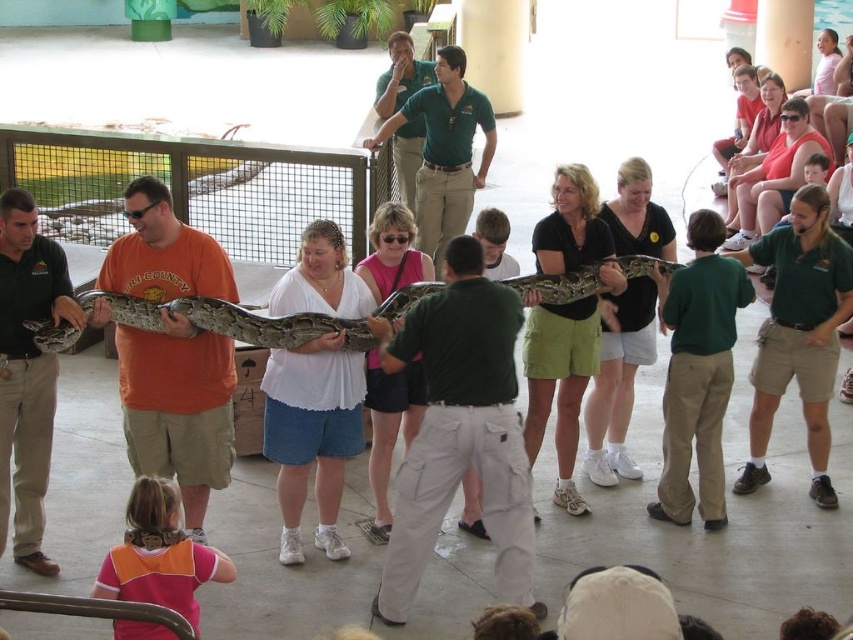
Question: Among these objects, which one is nearest to the camera?

Choices:
 (A) matte green shirt at center
 (B) white matte shirt at center
 (C) orange cotton shirt at center

Answer: (A)

Question: Can you confirm if matte green shirt at center is positioned to the right of shiny brown snake at center?

Choices:
 (A) no
 (B) yes

Answer: (A)

Question: Which of the following is the closest to the observer?

Choices:
 (A) orange cotton shirt at center
 (B) matte green shirt at center
 (C) camouflage snake at center
 (D) white matte shirt at center

Answer: (B)

Question: Considering the relative positions of matte green shirt at center and shiny brown snake at center in the image provided, where is matte green shirt at center located with respect to shiny brown snake at center?

Choices:
 (A) above
 (B) below

Answer: (B)

Question: Which point is farther to the camera?

Choices:
 (A) (276, 337)
 (B) (355, 300)

Answer: (B)

Question: Can you confirm if white matte shirt at center is positioned above shiny brown snake at center?

Choices:
 (A) no
 (B) yes

Answer: (A)